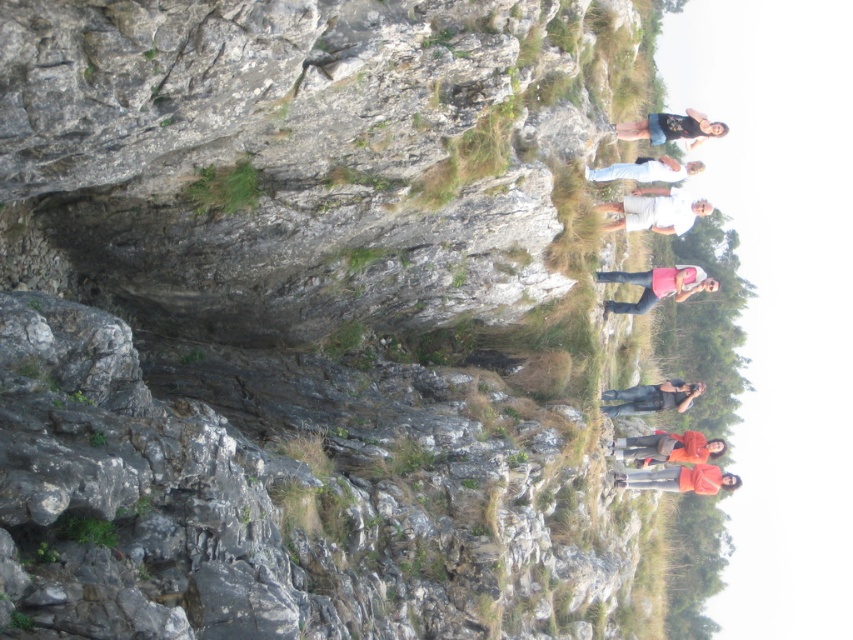
You are a photographer aiming to capture a photo of the denim jeans at center and the white cotton shirt at upper center. Based on their positions, which object should you focus on first if you want to ensure both are in sharp focus without moving the camera?

The denim jeans at center is located below the white cotton shirt at upper center. To keep both in focus, you should focus on the white cotton shirt at upper center first since it is farther away and has a smaller depth of field requirement, ensuring the denim jeans at center will also be in focus when focused on the farther object.